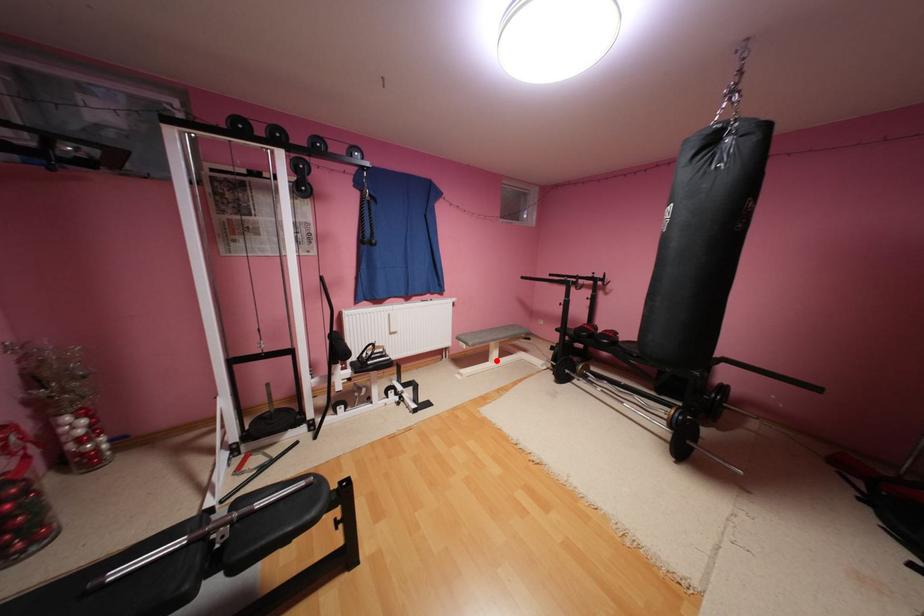
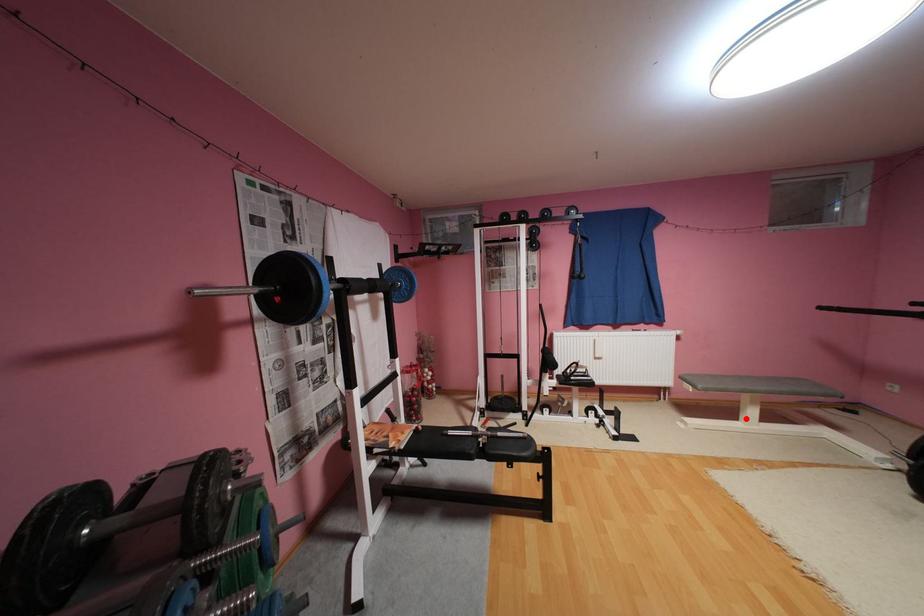
I am providing you with two images of the same scene from different viewpoints. A red point is marked on the first image and another point is marked on the second image. Does the point marked in image1 correspond to the same location as the one in image2?

Yes